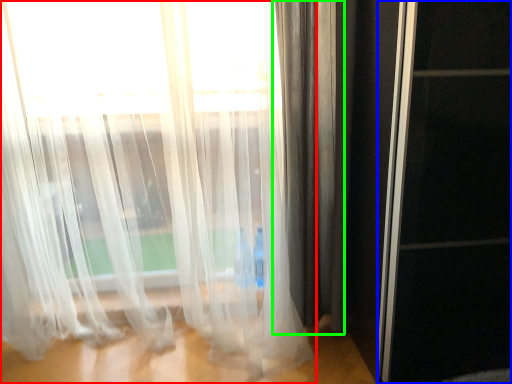
Question: Estimate the real-world distances between objects in this image. Which object is closer to curtain (highlighted by a red box), screen door (highlighted by a blue box) or curtain (highlighted by a green box)?

Choices:
 (A) screen door
 (B) curtain

Answer: (B)